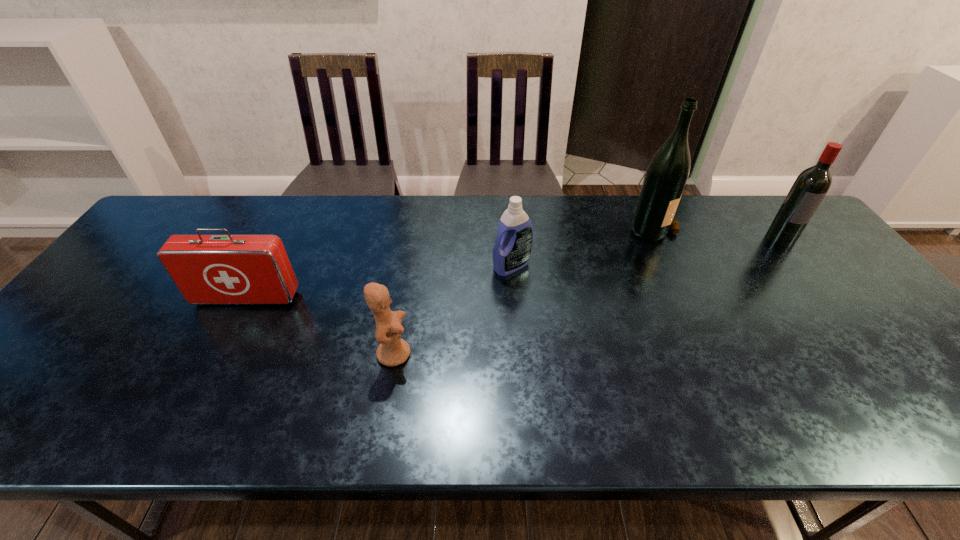
Identify the location of vacant space situated 0.330m on the right of the left wine bottle. (781, 227).

Image resolution: width=960 pixels, height=540 pixels. I want to click on vacant space located on the label of the shorter wine bottle, so click(796, 258).

What are the coordinates of `free region located on the side of the fourth farthest object with the first aid cross symbol` in the screenshot? It's located at (180, 423).

This screenshot has width=960, height=540. Find the location of `free space located 0.090m on the right of the detergent`. free space located 0.090m on the right of the detergent is located at coordinates (563, 266).

Where is `free space located on the front-facing side of the figurine`? Image resolution: width=960 pixels, height=540 pixels. free space located on the front-facing side of the figurine is located at coordinates (510, 353).

You are a GUI agent. You are given a task and a screenshot of the screen. Output one action in this format:
    pyautogui.click(x=<x>, y=<y>)
    Task: Click on the object present at the right edge
    The image size is (960, 540).
    Given the screenshot: What is the action you would take?
    pyautogui.click(x=810, y=187)

At what (x,y) coordinates should I click in order to perform the action: click on object present at the far right corner. Please return your answer as a coordinate pair (x, y). The width and height of the screenshot is (960, 540). Looking at the image, I should click on (810, 187).

Image resolution: width=960 pixels, height=540 pixels. I want to click on vacant region at the far edge of the desktop, so click(x=391, y=234).

Locate an element on the screen. This screenshot has width=960, height=540. free spot at the near edge of the desktop is located at coordinates (400, 410).

This screenshot has height=540, width=960. I want to click on vacant space at the left edge, so pos(156,251).